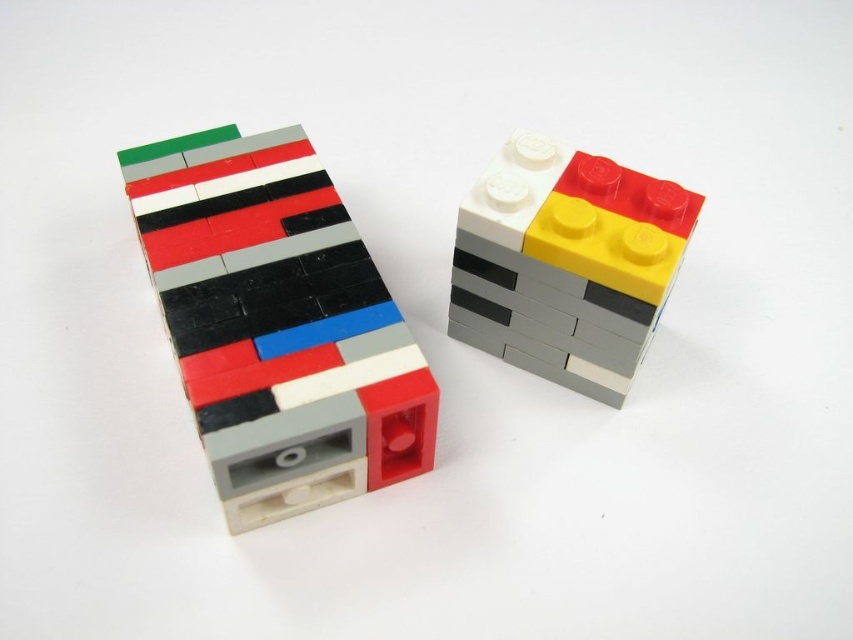
Question: Which of the following is the farthest from the observer?

Choices:
 (A) matte plastic brick at upper right
 (B) matte plastic bricks at left

Answer: (A)

Question: Can you confirm if matte plastic bricks at left is positioned above matte plastic brick at upper right?

Choices:
 (A) no
 (B) yes

Answer: (A)

Question: Which point is closer to the camera?

Choices:
 (A) matte plastic brick at upper right
 (B) matte plastic bricks at left

Answer: (B)

Question: Is matte plastic bricks at left smaller than matte plastic brick at upper right?

Choices:
 (A) yes
 (B) no

Answer: (B)

Question: Does matte plastic bricks at left appear on the left side of matte plastic brick at upper right?

Choices:
 (A) no
 (B) yes

Answer: (B)